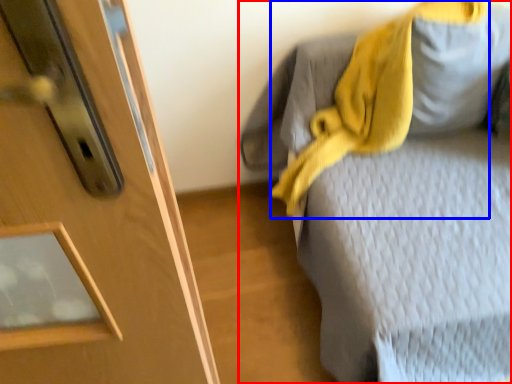
Question: Among these objects, which one is nearest to the camera, furniture (highlighted by a red box) or scarf (highlighted by a blue box)?

Choices:
 (A) furniture
 (B) scarf

Answer: (A)